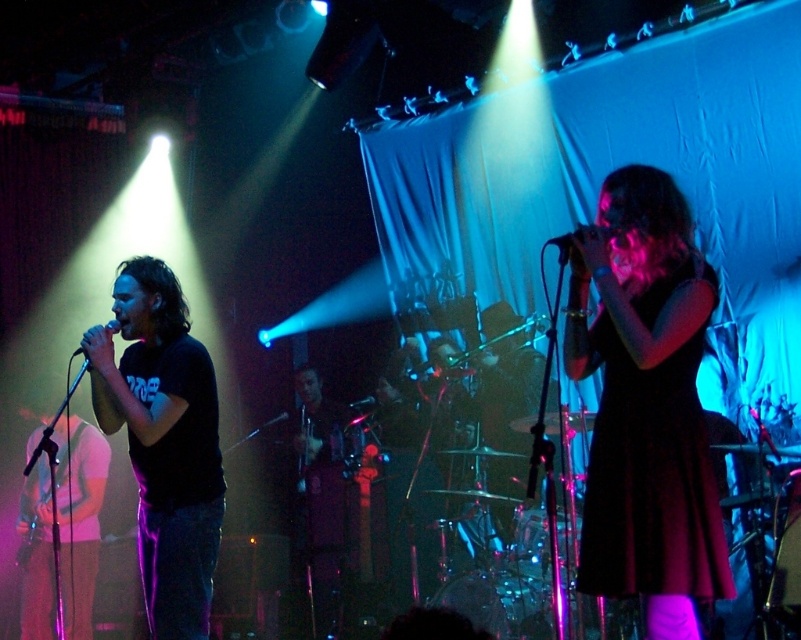
You are a photographer standing in the audience and want to capture a close shot of the two points on the stage marked as point (x=147, y=445) and point (x=57, y=500). Which point should you focus on first to get a clearer image?

Point (x=147, y=445) is closer to the viewer than point (x=57, y=500), so focusing on point (x=147, y=445) first will ensure a clearer image.